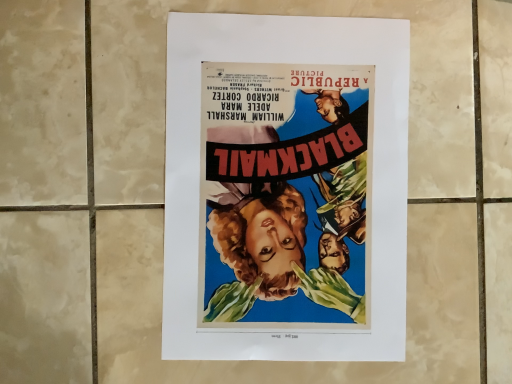
What do you see at coordinates (285, 188) in the screenshot? This screenshot has height=384, width=512. I see `vibrant paper poster at center` at bounding box center [285, 188].

Identify the location of vibrant paper poster at center. This screenshot has height=384, width=512. (285, 188).

Locate an element on the screen. Image resolution: width=512 pixels, height=384 pixels. vibrant paper poster at center is located at coordinates (285, 188).